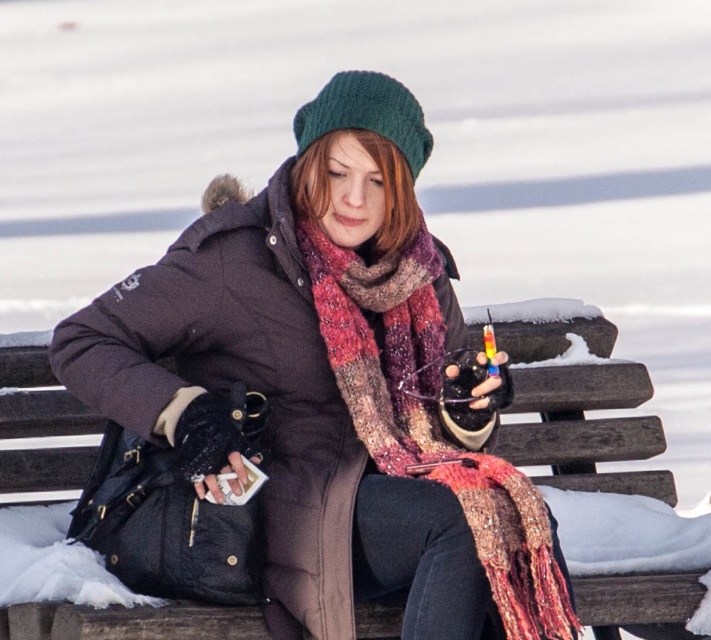
Question: Which point is closer to the camera taking this photo?

Choices:
 (A) (529, 538)
 (B) (560, 502)
 (C) (434, 632)

Answer: (C)

Question: Is matte black coat at center below knitted wool scarf at center?

Choices:
 (A) yes
 (B) no

Answer: (A)

Question: Which point appears farthest from the camera in this image?

Choices:
 (A) (230, 228)
 (B) (33, 401)

Answer: (B)

Question: Is matte black coat at center above brown wooden bench at center?

Choices:
 (A) yes
 (B) no

Answer: (A)

Question: Which object appears farthest from the camera in this image?

Choices:
 (A) knitted wool scarf at center
 (B) brown wooden bench at center
 (C) matte black coat at center

Answer: (B)

Question: Can you confirm if matte black coat at center is positioned to the right of brown wooden bench at center?

Choices:
 (A) yes
 (B) no

Answer: (B)